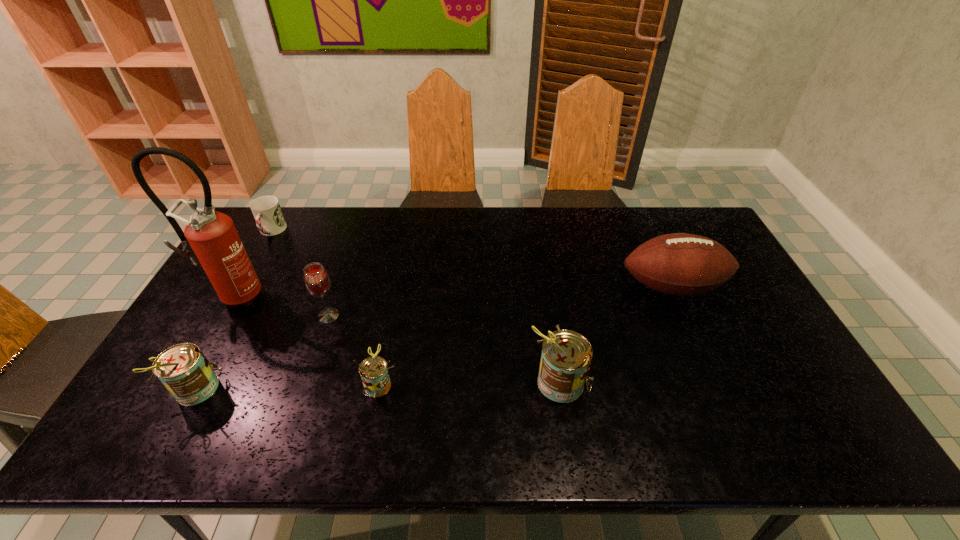
Observe the arrangement of all cans in the image. To keep them evenly spaced, where would you place another can on the right? Please locate a free space. Please provide its 2D coordinates. Your answer should be formatted as a tuple, i.e. [(x, y)], where the tuple contains the x and y coordinates of a point satisfying the conditions above.

[(738, 380)]